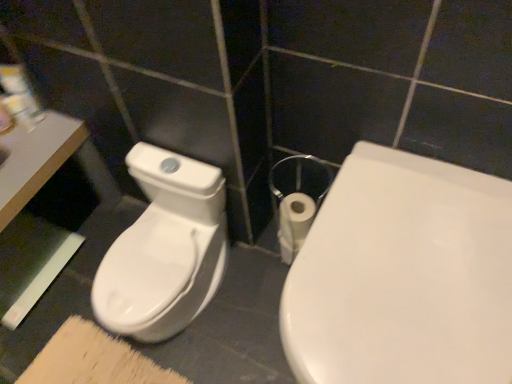
Image resolution: width=512 pixels, height=384 pixels. What do you see at coordinates (403, 276) in the screenshot?
I see `white glossy toilet at center` at bounding box center [403, 276].

Find the location of a particular element. This screenshot has height=384, width=512. white glossy toilet at center is located at coordinates (403, 276).

This screenshot has height=384, width=512. In order to click on white glossy toilet at center in this screenshot , I will do `click(403, 276)`.